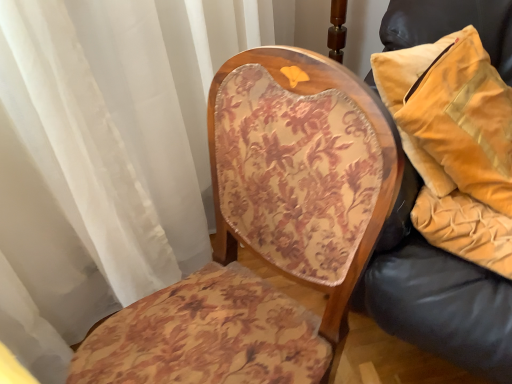
Question: Would you say velvet/yellow pillow at right is outside velvet yellow pillow at right?

Choices:
 (A) no
 (B) yes

Answer: (A)

Question: Is velvet/yellow pillow at right placed right next to velvet yellow pillow at right?

Choices:
 (A) yes
 (B) no

Answer: (B)

Question: Is velvet/yellow pillow at right turned away from velvet yellow pillow at right?

Choices:
 (A) yes
 (B) no

Answer: (A)

Question: From the image's perspective, is velvet/yellow pillow at right below velvet yellow pillow at right?

Choices:
 (A) no
 (B) yes

Answer: (A)

Question: Can you confirm if velvet/yellow pillow at right is bigger than velvet yellow pillow at right?

Choices:
 (A) no
 (B) yes

Answer: (B)

Question: Is velvet/yellow pillow at right at the left side of velvet yellow pillow at right?

Choices:
 (A) yes
 (B) no

Answer: (A)

Question: Does velvet/yellow pillow at right have a greater height compared to floral-patterned fabric chair at center?

Choices:
 (A) yes
 (B) no

Answer: (B)

Question: Is velvet/yellow pillow at right at the left side of floral-patterned fabric chair at center?

Choices:
 (A) yes
 (B) no

Answer: (B)

Question: From a real-world perspective, is velvet/yellow pillow at right beneath floral-patterned fabric chair at center?

Choices:
 (A) no
 (B) yes

Answer: (A)

Question: Considering the relative positions of velvet/yellow pillow at right and floral-patterned fabric chair at center in the image provided, is velvet/yellow pillow at right behind floral-patterned fabric chair at center?

Choices:
 (A) no
 (B) yes

Answer: (B)

Question: Is velvet/yellow pillow at right positioned with its back to floral-patterned fabric chair at center?

Choices:
 (A) no
 (B) yes

Answer: (A)

Question: Is velvet/yellow pillow at right thinner than floral-patterned fabric chair at center?

Choices:
 (A) yes
 (B) no

Answer: (A)

Question: Can you confirm if floral-patterned fabric chair at center is positioned to the right of velvet yellow pillow at right?

Choices:
 (A) no
 (B) yes

Answer: (A)